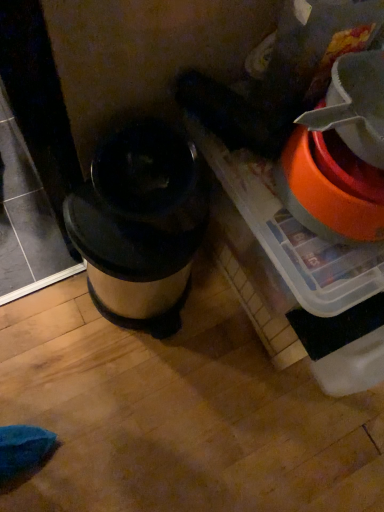
Question: In terms of height, does orange plastic bucket at right look taller or shorter compared to metallic silver trash can at center?

Choices:
 (A) tall
 (B) short

Answer: (B)

Question: Is orange plastic bucket at right situated inside metallic silver trash can at center or outside?

Choices:
 (A) inside
 (B) outside

Answer: (B)

Question: Is point (342, 227) positioned closer to the camera than point (162, 335)?

Choices:
 (A) farther
 (B) closer

Answer: (B)

Question: From the image's perspective, relative to orange plastic bucket at right, is metallic silver trash can at center above or below?

Choices:
 (A) above
 (B) below

Answer: (B)

Question: In terms of width, does metallic silver trash can at center look wider or thinner when compared to orange plastic bucket at right?

Choices:
 (A) thin
 (B) wide

Answer: (B)

Question: Is point (140, 233) positioned closer to the camera than point (362, 53)?

Choices:
 (A) closer
 (B) farther

Answer: (B)

Question: Based on their sizes in the image, would you say metallic silver trash can at center is bigger or smaller than orange plastic bucket at right?

Choices:
 (A) small
 (B) big

Answer: (B)